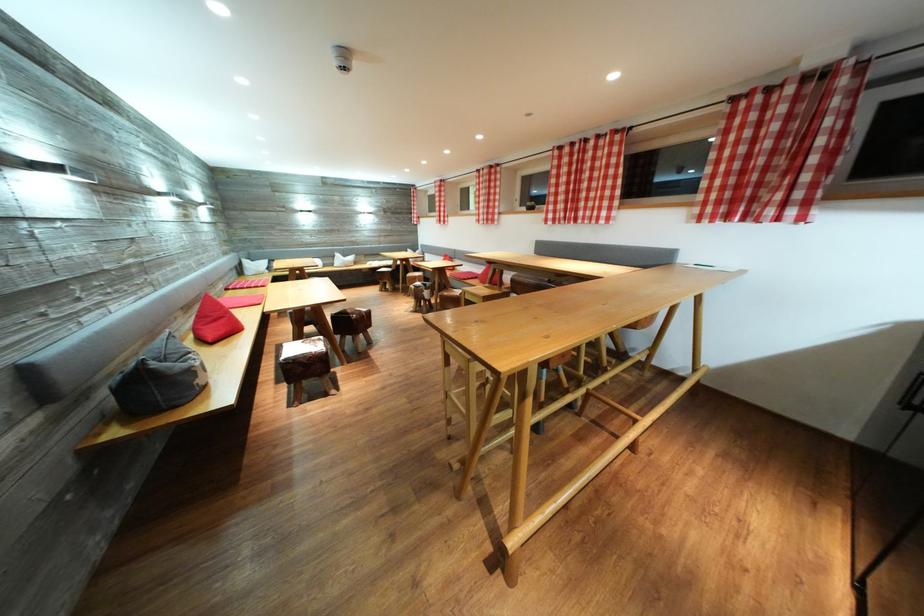
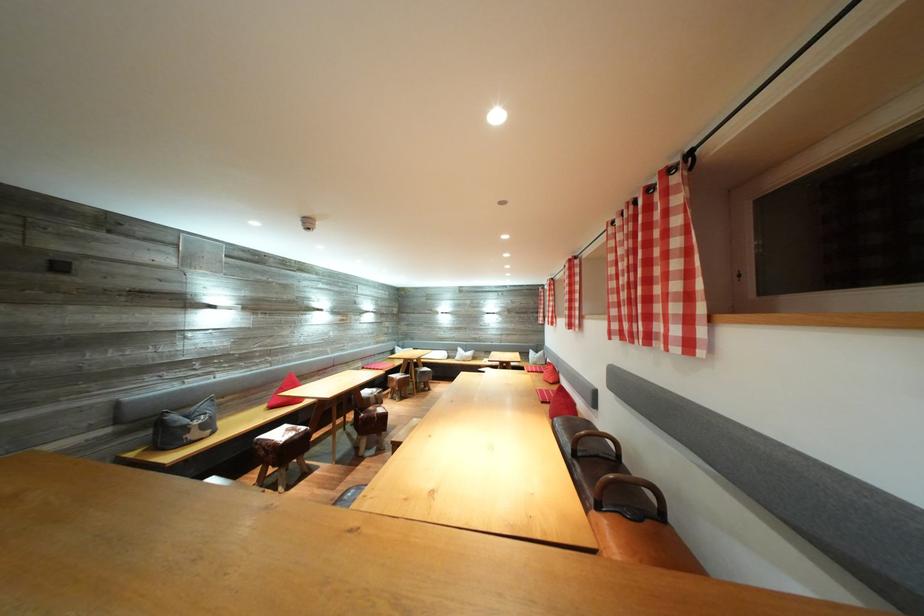
Question: I am providing you with two images of the same scene from different viewpoints. Which of the following objects are not visible in image2?

Choices:
 (A) red seat cushion
 (B) cowhide stool
 (C) sofa sitting surface
 (D) clear bottle with blue cap

Answer: (B)